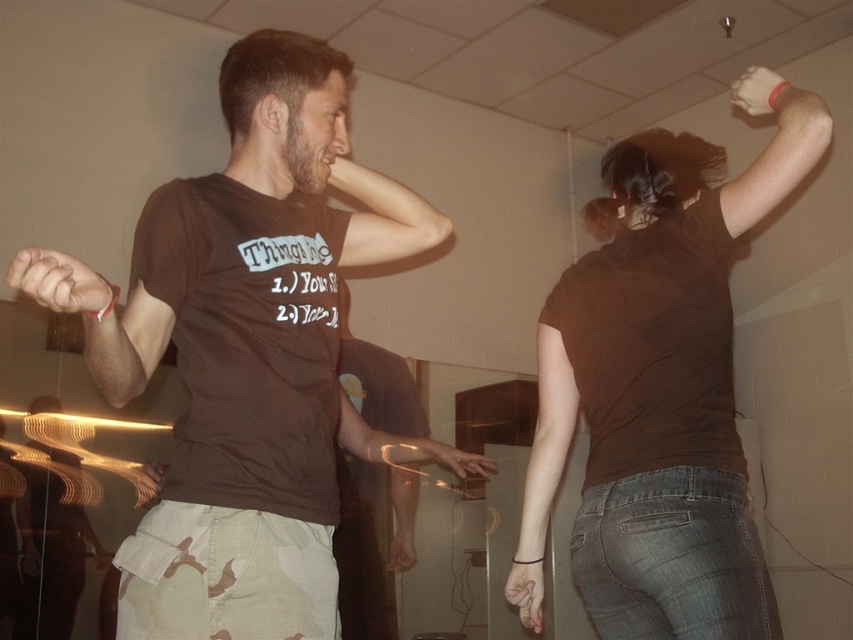
Question: Does brown cotton t-shirt at left appear over brown matte shirt at upper right?

Choices:
 (A) no
 (B) yes

Answer: (B)

Question: Is brown cotton t-shirt at left above brown matte shirt at upper right?

Choices:
 (A) no
 (B) yes

Answer: (B)

Question: Is brown cotton t-shirt at left below brown matte shirt at upper right?

Choices:
 (A) no
 (B) yes

Answer: (A)

Question: Which point appears closest to the camera in this image?

Choices:
 (A) (622, 560)
 (B) (169, 300)

Answer: (B)